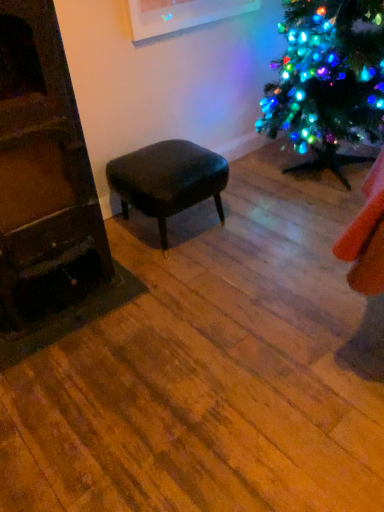
In order to click on matte black stool at center in this screenshot , I will do `click(168, 180)`.

Measure the distance between matte black stool at center and camera.

matte black stool at center and camera are 5.53 feet apart from each other.

Describe the element at coordinates (168, 180) in the screenshot. I see `matte black stool at center` at that location.

You are a GUI agent. You are given a task and a screenshot of the screen. Output one action in this format:
    pyautogui.click(x=<x>, y=<y>)
    Task: Click on the matte black stool at center
    
    Given the screenshot: What is the action you would take?
    pyautogui.click(x=168, y=180)